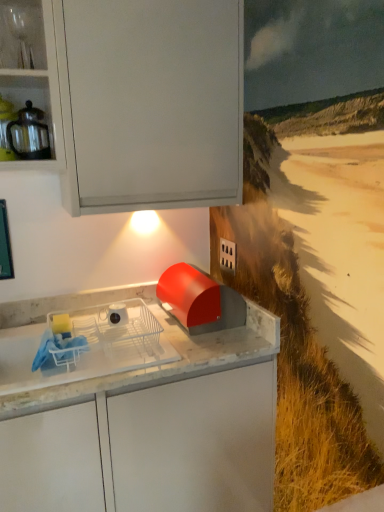
Question: Can you confirm if white glossy mug at center is positioned to the left of matte glass teapot at upper left?

Choices:
 (A) no
 (B) yes

Answer: (A)

Question: Is white glossy mug at center positioned far away from matte glass teapot at upper left?

Choices:
 (A) yes
 (B) no

Answer: (B)

Question: Does white glossy mug at center have a greater width compared to matte glass teapot at upper left?

Choices:
 (A) yes
 (B) no

Answer: (A)

Question: Can you confirm if white glossy mug at center is smaller than matte glass teapot at upper left?

Choices:
 (A) no
 (B) yes

Answer: (B)

Question: Is the position of white glossy mug at center more distant than that of matte glass teapot at upper left?

Choices:
 (A) yes
 (B) no

Answer: (A)

Question: Are white glossy mug at center and matte glass teapot at upper left making contact?

Choices:
 (A) no
 (B) yes

Answer: (A)

Question: Is white plastic dish rack at center further to camera compared to matte glass teapot at upper left?

Choices:
 (A) yes
 (B) no

Answer: (B)

Question: Considering the relative positions of white plastic dish rack at center and matte glass teapot at upper left in the image provided, is white plastic dish rack at center to the left of matte glass teapot at upper left from the viewer's perspective?

Choices:
 (A) no
 (B) yes

Answer: (A)

Question: Is white plastic dish rack at center positioned before matte glass teapot at upper left?

Choices:
 (A) yes
 (B) no

Answer: (A)

Question: Does white plastic dish rack at center have a greater height compared to matte glass teapot at upper left?

Choices:
 (A) no
 (B) yes

Answer: (A)

Question: From a real-world perspective, is white plastic dish rack at center positioned over matte glass teapot at upper left based on gravity?

Choices:
 (A) no
 (B) yes

Answer: (A)

Question: Is white plastic dish rack at center shorter than matte glass teapot at upper left?

Choices:
 (A) no
 (B) yes

Answer: (B)

Question: From a real-world perspective, is white glossy mug at center under clear glassware at upper left?

Choices:
 (A) yes
 (B) no

Answer: (A)